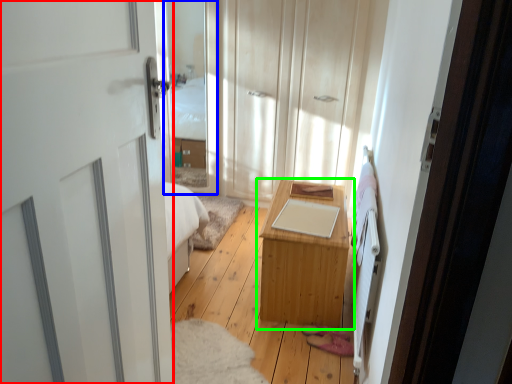
Question: Considering the real-world distances, which object is farthest from door (highlighted by a red box)? glass door (highlighted by a blue box) or table (highlighted by a green box)?

Choices:
 (A) glass door
 (B) table

Answer: (A)